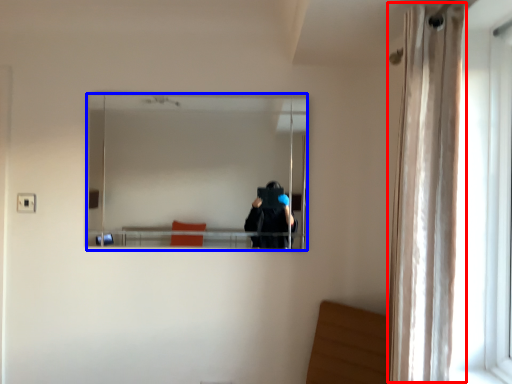
Question: Which object appears closest to the camera in this image, curtain (highlighted by a red box) or mirror (highlighted by a blue box)?

Choices:
 (A) curtain
 (B) mirror

Answer: (A)